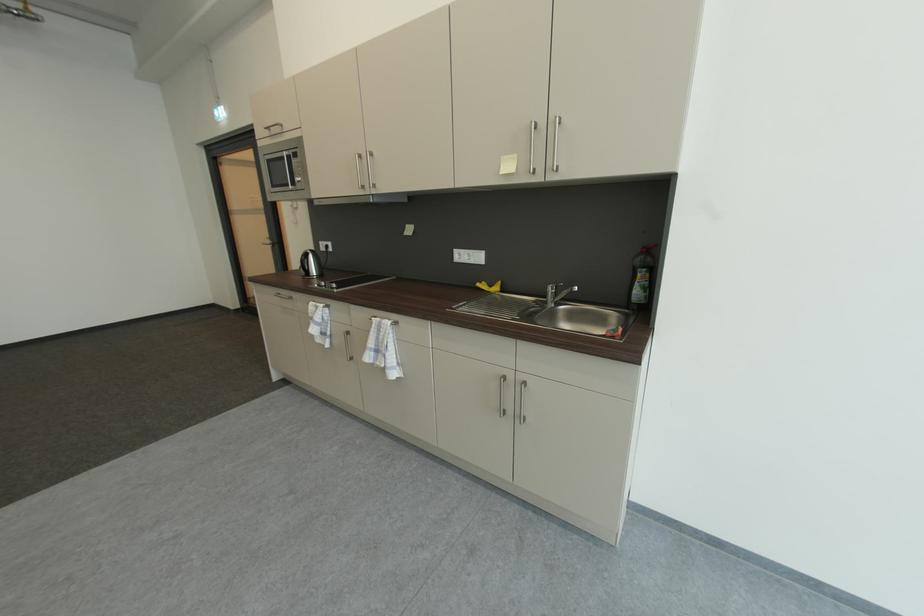
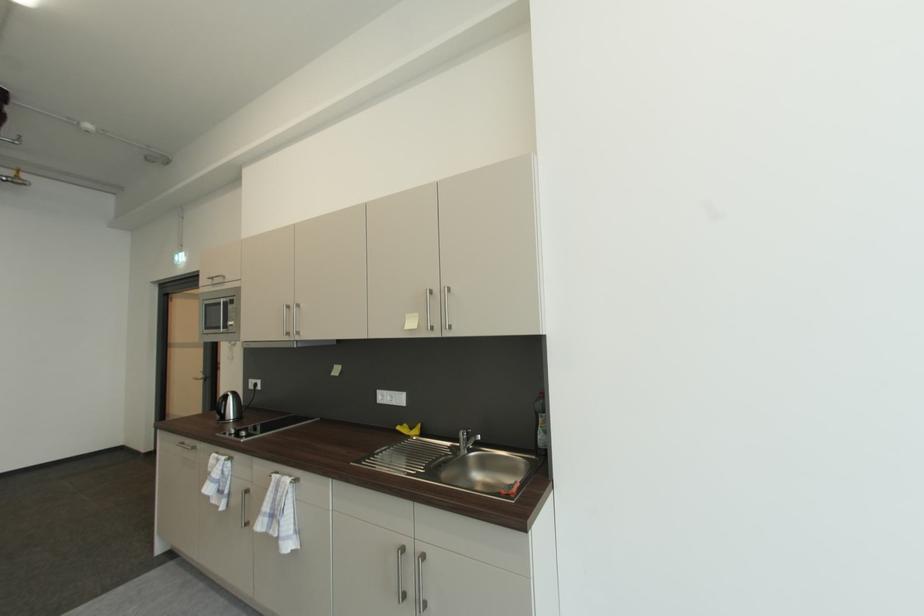
Find the pixel in the second image that matches [487,284] in the first image.

(408, 427)